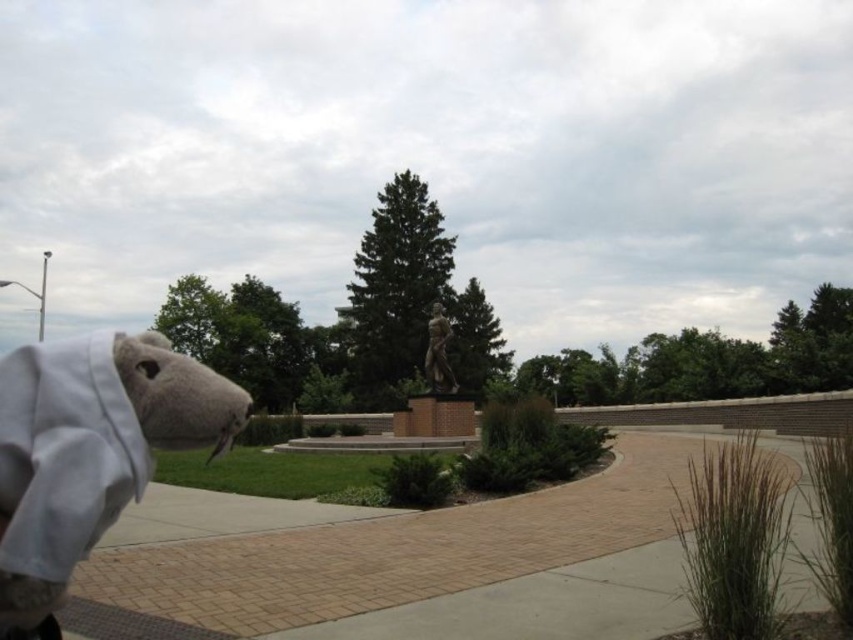
Describe the element at coordinates (401, 564) in the screenshot. I see `brick pavement at center` at that location.

Who is more distant from viewer, [465,612] or [84,499]?

The point [465,612] is more distant.

Where is `brick pavement at center`? brick pavement at center is located at coordinates 401,564.

Consider the image. Between white plush toy at left and bronze statue at center, which one is positioned lower?

white plush toy at left is below.

Between point (161, 385) and point (434, 384), which one is positioned in front?

Point (161, 385) is more forward.

Is point (85, 406) closer to viewer compared to point (437, 365)?

Yes, point (85, 406) is in front of point (437, 365).

Where is `white plush toy at left`? Image resolution: width=853 pixels, height=640 pixels. white plush toy at left is located at coordinates (90, 448).

Locate an element on the screen. This screenshot has width=853, height=640. brick pavement at center is located at coordinates (401, 564).

Is point (650, 586) positioned behind point (436, 342)?

No.

Where is `brick pavement at center`? The width and height of the screenshot is (853, 640). brick pavement at center is located at coordinates (401, 564).